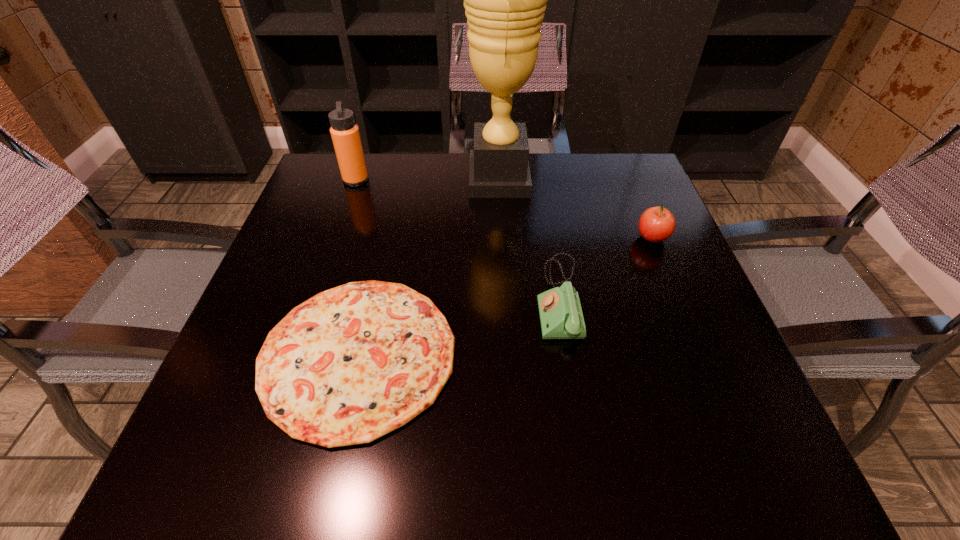
The image size is (960, 540). Find the location of `the fourth closest object to the third farthest object`. the fourth closest object to the third farthest object is located at coordinates (345, 134).

Select which object appears as the closest to the pizza. Please provide its 2D coordinates. Your answer should be formatted as a tuple, i.e. [(x, y)], where the tuple contains the x and y coordinates of a point satisfying the conditions above.

[(561, 317)]

You are a GUI agent. You are given a task and a screenshot of the screen. Output one action in this format:
    pyautogui.click(x=<x>, y=<y>)
    Task: Click on the vacant point that satisfies the following two spatial constraints: 1. on the front side of the second tallest object; 2. on the right side of the third tallest object
    
    Given the screenshot: What is the action you would take?
    pyautogui.click(x=336, y=238)

At what (x,y) coordinates should I click in order to perform the action: click on free location that satisfies the following two spatial constraints: 1. on the dial of the fourth tallest object; 2. on the front side of the shortest object. Please return your answer as a coordinate pair (x, y). The width and height of the screenshot is (960, 540). Looking at the image, I should click on (567, 354).